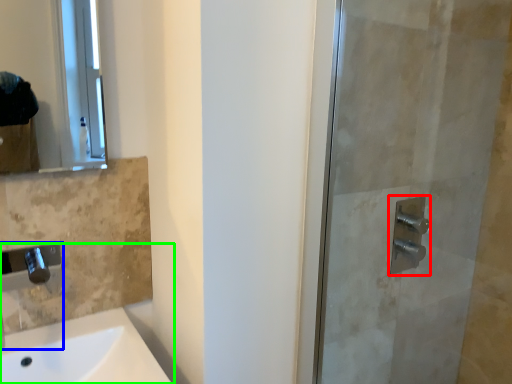
Question: Based on their relative distances, which object is nearer to shower (highlighted by a red box)? Choose from faucet (highlighted by a blue box) and sink (highlighted by a green box).

Choices:
 (A) faucet
 (B) sink

Answer: (B)